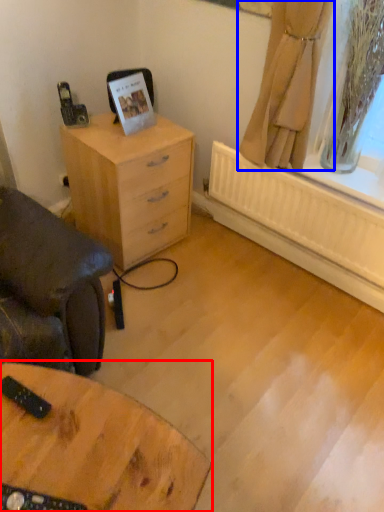
Question: Which point is further to the camera, table (highlighted by a red box) or curtain (highlighted by a blue box)?

Choices:
 (A) table
 (B) curtain

Answer: (B)